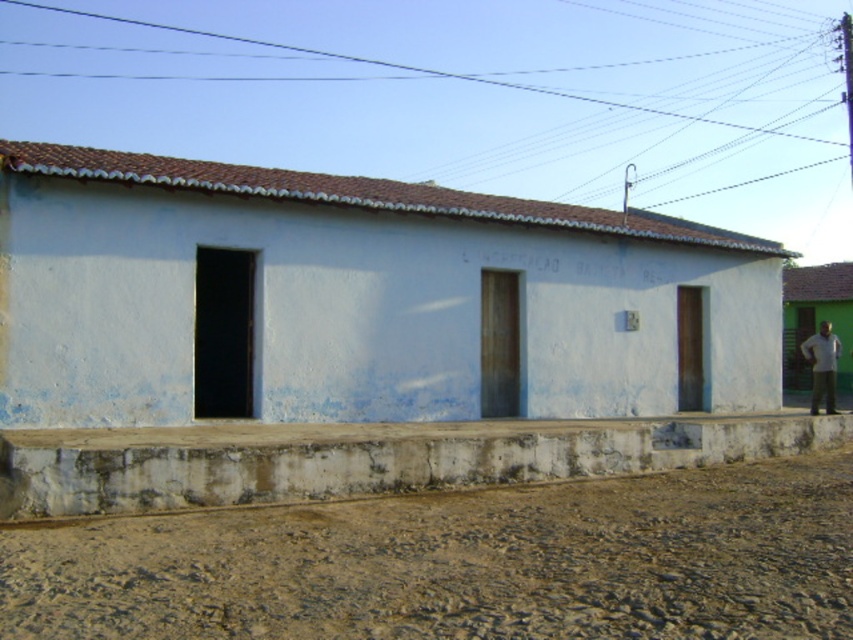
Question: Can you confirm if white matte hut at right is smaller than white cotton shirt at right?

Choices:
 (A) no
 (B) yes

Answer: (A)

Question: Among these objects, which one is nearest to the camera?

Choices:
 (A) white concrete ledge at lower center
 (B) white matte hut at right
 (C) white matte building at center

Answer: (A)

Question: Can you confirm if brown gravel at lower center is bigger than white matte hut at right?

Choices:
 (A) no
 (B) yes

Answer: (A)

Question: Is white concrete ledge at lower center thinner than white cotton shirt at right?

Choices:
 (A) no
 (B) yes

Answer: (A)

Question: Which of the following is the farthest from the observer?

Choices:
 (A) (181, 272)
 (B) (790, 308)
 (C) (566, 561)

Answer: (B)

Question: Which of the following is the farthest from the observer?

Choices:
 (A) (236, 208)
 (B) (810, 358)

Answer: (B)